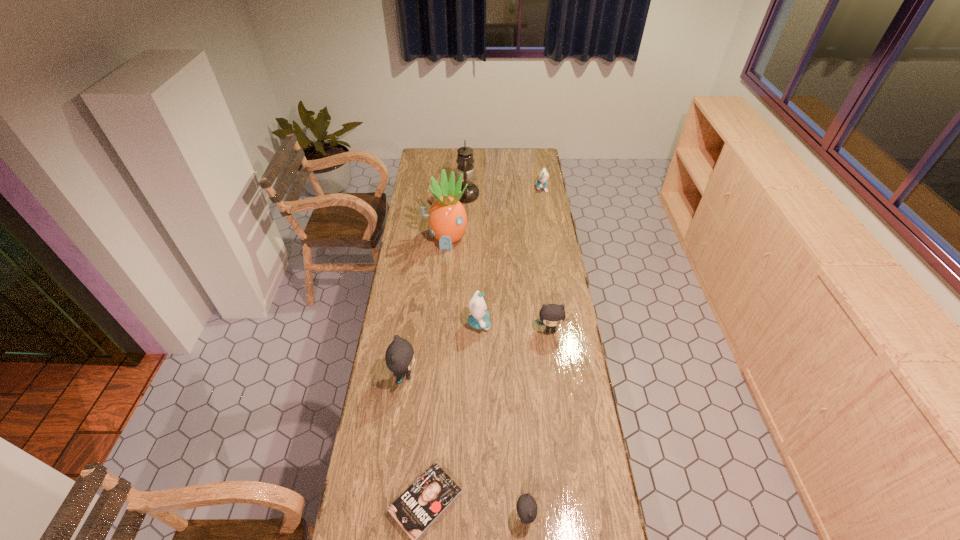
I want to click on free space located 0.140m on the face of the smaller blue kitten, so click(511, 188).

The image size is (960, 540). I want to click on vacant space positioned on the front-facing side of the nearest gray kitten, so click(x=414, y=517).

Where is `free space located 0.390m on the front-facing side of the nearest gray kitten`? free space located 0.390m on the front-facing side of the nearest gray kitten is located at coordinates (384, 517).

This screenshot has width=960, height=540. Find the location of `vacant area located 0.070m on the front-facing side of the nearest gray kitten`. vacant area located 0.070m on the front-facing side of the nearest gray kitten is located at coordinates (492, 517).

The width and height of the screenshot is (960, 540). Find the location of `pineapple located at the left edge`. pineapple located at the left edge is located at coordinates (447, 217).

Locate an element on the screen. kitten present at the left edge is located at coordinates (399, 357).

Locate an element on the screen. vacant space at the far edge of the desktop is located at coordinates (445, 158).

Where is `free space at the left edge`? free space at the left edge is located at coordinates (410, 303).

This screenshot has width=960, height=540. In order to click on free space at the right edge in this screenshot , I will do `click(560, 449)`.

This screenshot has height=540, width=960. I want to click on free space at the far right corner of the desktop, so click(x=518, y=151).